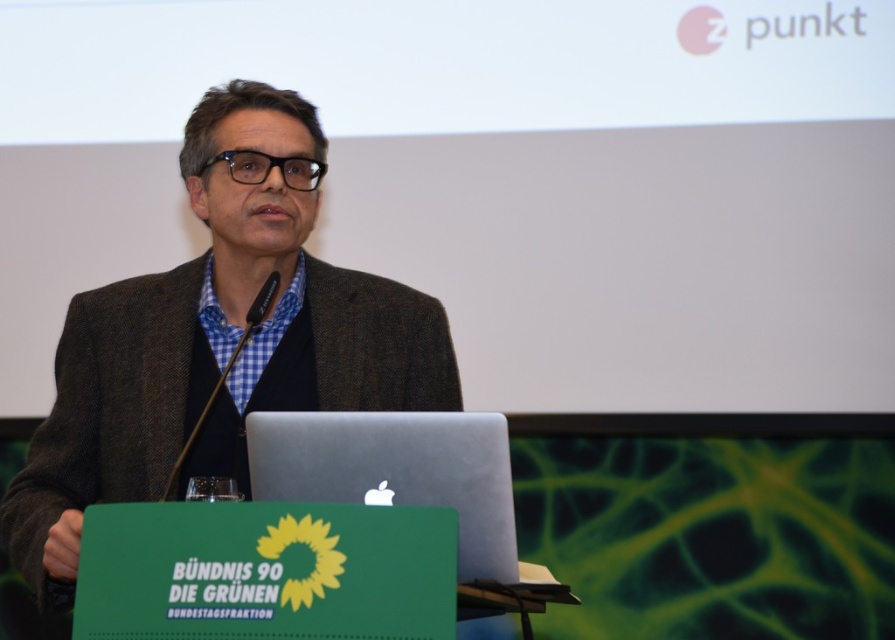
Question: Which of the following is the farthest from the observer?

Choices:
 (A) silver metallic laptop at center
 (B) brown woolen jacket at center

Answer: (B)

Question: Which point is farther from the camera taking this photo?

Choices:
 (A) (333, 474)
 (B) (71, 572)

Answer: (A)

Question: Which point is farther to the camera?

Choices:
 (A) silver metallic laptop at center
 (B) brown woolen jacket at center

Answer: (B)

Question: Is brown woolen jacket at center thinner than silver metallic laptop at center?

Choices:
 (A) no
 (B) yes

Answer: (A)

Question: In this image, where is brown woolen jacket at center located relative to silver metallic laptop at center?

Choices:
 (A) above
 (B) below

Answer: (A)

Question: Does brown woolen jacket at center come in front of silver metallic laptop at center?

Choices:
 (A) no
 (B) yes

Answer: (A)